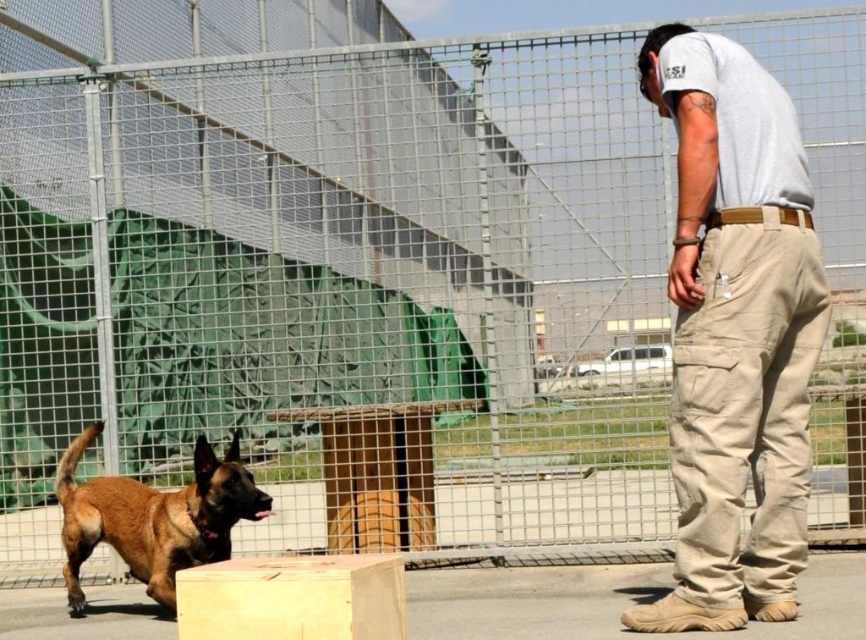
You are a photographer standing at the back of the scene. You want to take a photo of the brown fur dog at left and the light brown wood at center. Which object will appear closer to you in the photo?

The brown fur dog at left will appear closer to you in the photo because it is positioned further to the viewer than the light brown wood at center.